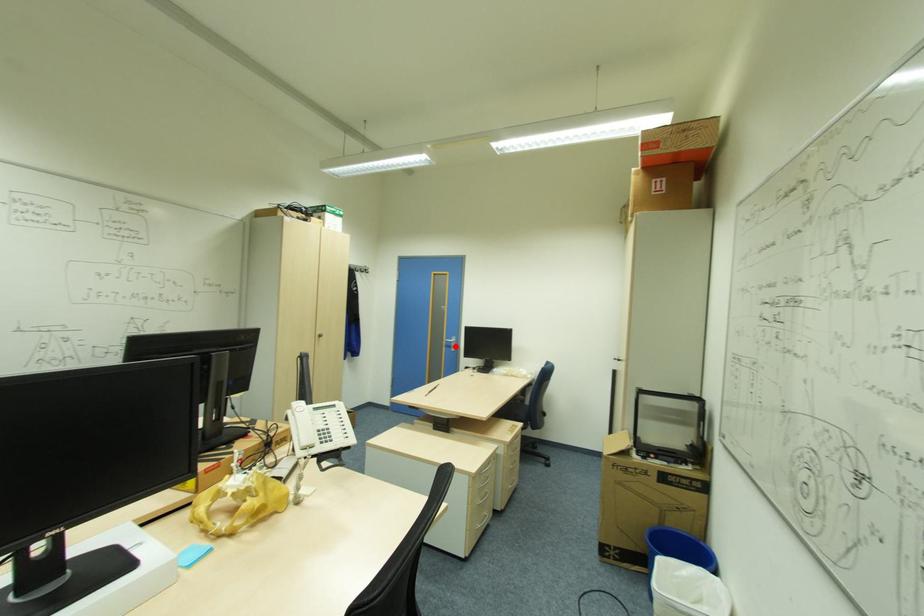
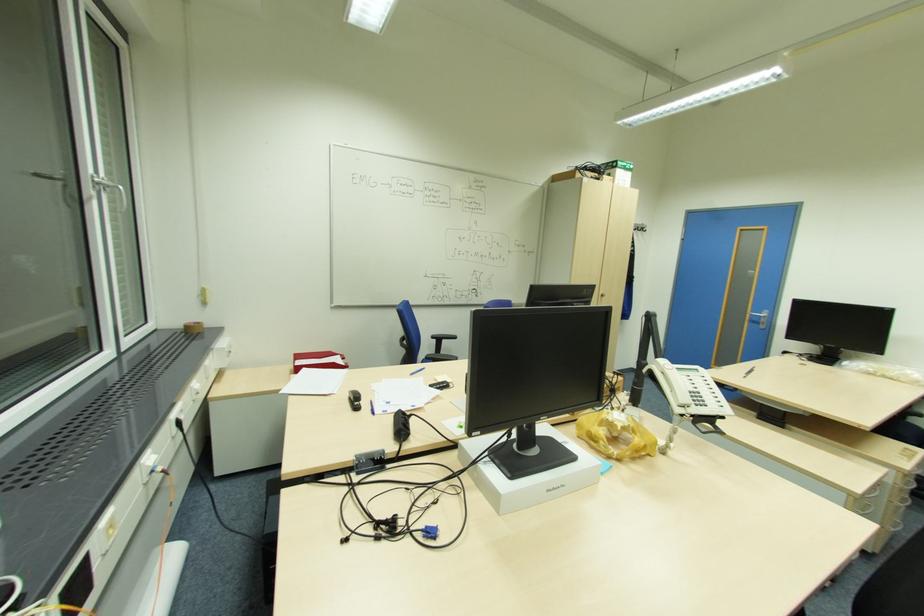
Find the pixel in the second image that matches the highlighted location in the first image.

(766, 323)